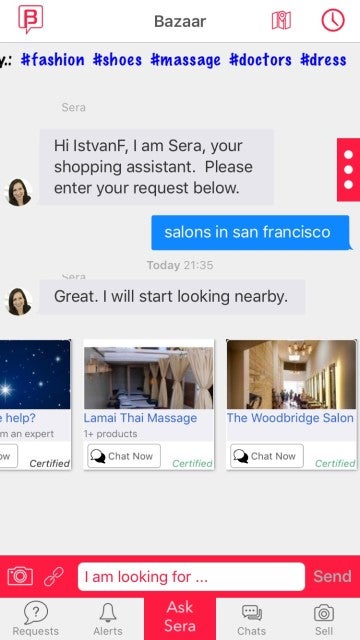
Where is `chandalier`? This screenshot has width=360, height=640. chandalier is located at coordinates (300, 349).